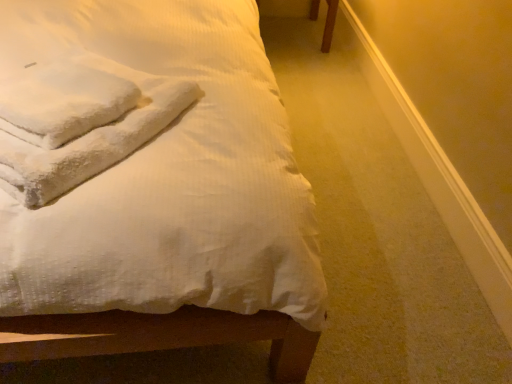
Question: From the image's perspective, relative to white fluffy towels at upper left, is white textured bed at upper left above or below?

Choices:
 (A) above
 (B) below

Answer: (A)

Question: In terms of height, does white textured bed at upper left look taller or shorter compared to white fluffy towels at upper left?

Choices:
 (A) tall
 (B) short

Answer: (A)

Question: Considering the positions of white textured bed at upper left and white fluffy towels at upper left in the image, is white textured bed at upper left wider or thinner than white fluffy towels at upper left?

Choices:
 (A) wide
 (B) thin

Answer: (A)

Question: From the image's perspective, is white fluffy towels at upper left above or below white textured bed at upper left?

Choices:
 (A) above
 (B) below

Answer: (B)

Question: Considering the positions of white fluffy towels at upper left and white textured bed at upper left in the image, is white fluffy towels at upper left wider or thinner than white textured bed at upper left?

Choices:
 (A) thin
 (B) wide

Answer: (A)

Question: In the image, is white fluffy towels at upper left positioned in front of or behind white textured bed at upper left?

Choices:
 (A) behind
 (B) front

Answer: (A)

Question: Does point (114, 125) appear closer or farther from the camera than point (183, 266)?

Choices:
 (A) farther
 (B) closer

Answer: (A)